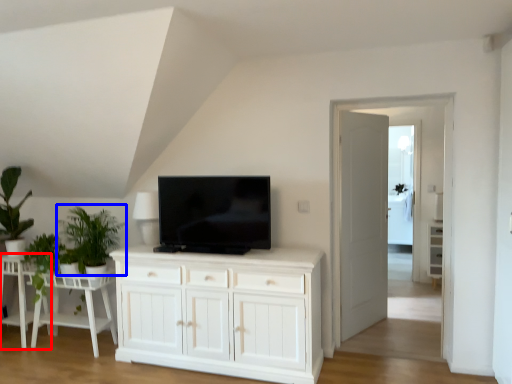
Question: Among these objects, which one is nearest to the camera, table (highlighted by a red box) or plant (highlighted by a blue box)?

Choices:
 (A) table
 (B) plant

Answer: (B)